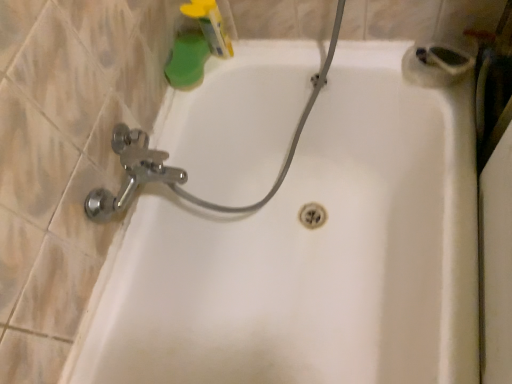
You are a GUI agent. You are given a task and a screenshot of the screen. Output one action in this format:
    pyautogui.click(x=<x>, y=<y>)
    Task: Click on the white plastic shower at upper right
    Image resolution: width=512 pixels, height=384 pixels.
    Given the screenshot: What is the action you would take?
    pyautogui.click(x=435, y=65)

This screenshot has height=384, width=512. What do you see at coordinates (435, 65) in the screenshot? I see `white plastic shower at upper right` at bounding box center [435, 65].

Where is `white plastic shower at upper right`? The image size is (512, 384). white plastic shower at upper right is located at coordinates (435, 65).